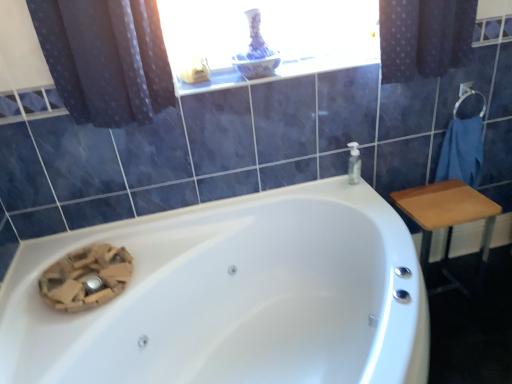
The width and height of the screenshot is (512, 384). In order to click on vacant space that is to the left of transparent plastic soap dispenser at upper right in this screenshot , I will do `click(327, 184)`.